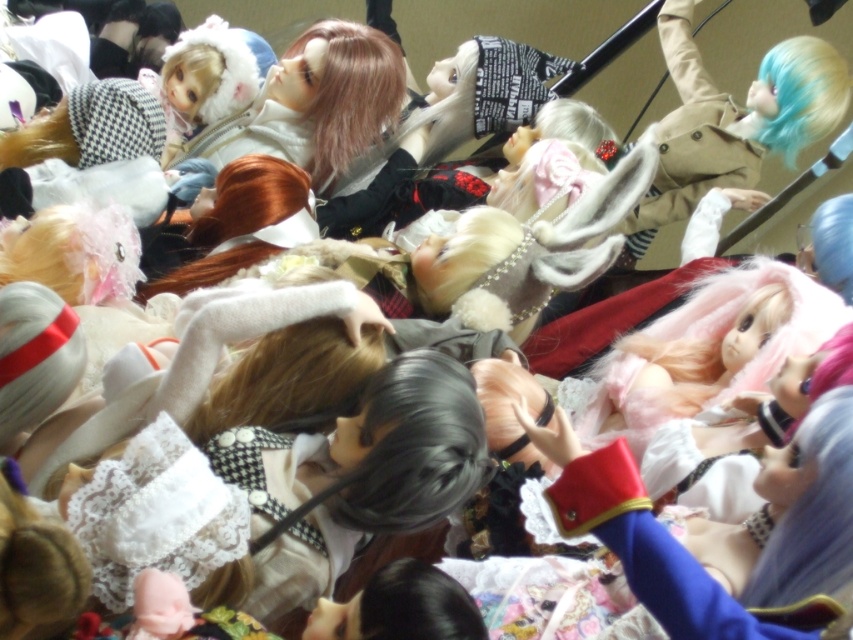
You are a collector trying to organize these dolls. You notice two points where you want to place new dolls. The first point is at coordinate point(x=825, y=220) and the second is at point(x=554, y=104). Which point is closer to the viewer?

Point(x=825, y=220) is in front of point(x=554, y=104), so it is closer to the viewer.

You are organizing a display of dolls and need to ensure that the tallest hair style is placed at the back to avoid blocking the view of smaller ones. Given the dolls with fluffy white hair at center and white silky hair at center, which one should be placed at the back?

The fluffy white hair at center should be placed at the back since it is taller than the white silky hair at center, preventing it from blocking the view of the shorter one.

In the scene with dolls arranged in a somewhat chaotic manner, you notice the blue silky hair at upper right and the white silky hair at center. Which doll has its hair positioned to the right side of the other?

The blue silky hair at upper right is positioned to the right of the white silky hair at center.